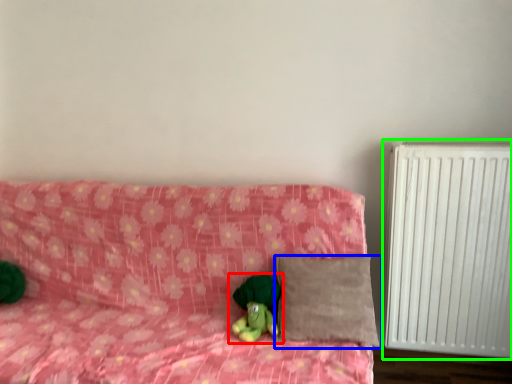
Question: Considering the real-world distances, which object is closest to toy (highlighted by a red box)? pillow (highlighted by a blue box) or radiator (highlighted by a green box).

Choices:
 (A) pillow
 (B) radiator

Answer: (A)